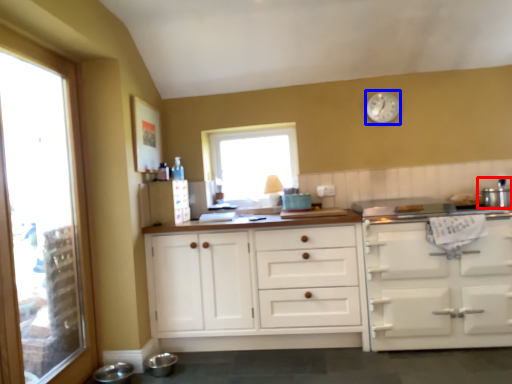
Question: Which object is closer to the camera taking this photo, appliance (highlighted by a red box) or clock (highlighted by a blue box)?

Choices:
 (A) appliance
 (B) clock

Answer: (A)